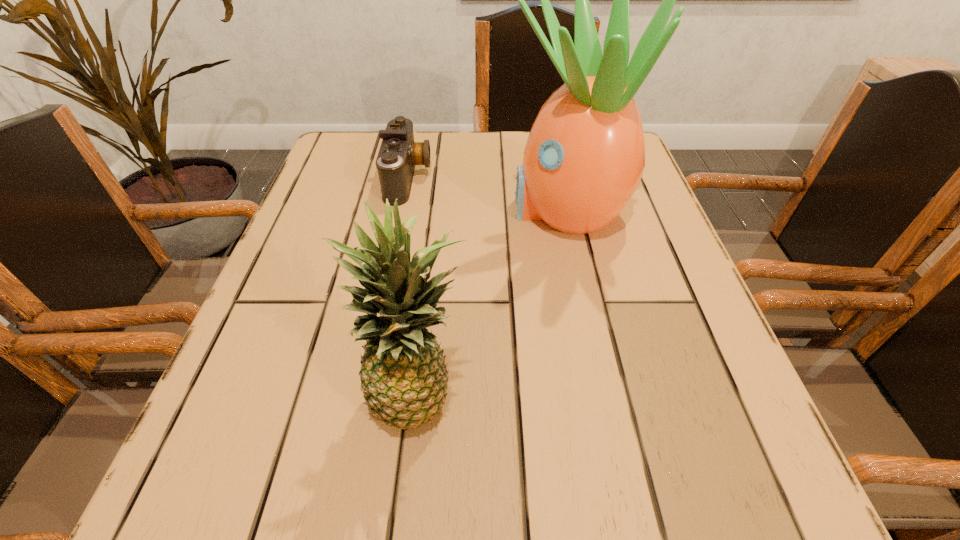
Where is `free space that satisfies the following two spatial constraints: 1. on the lens of the nearer pineapple; 2. on the left side of the camera`? free space that satisfies the following two spatial constraints: 1. on the lens of the nearer pineapple; 2. on the left side of the camera is located at coordinates [x=364, y=394].